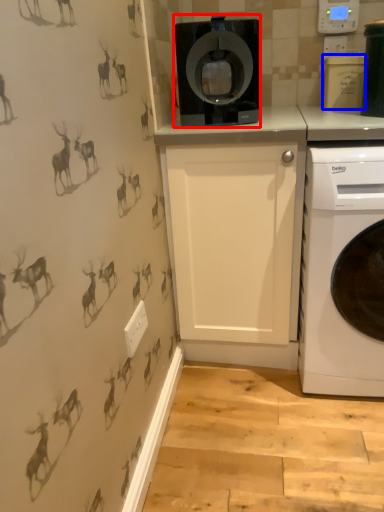
Question: Which object is closer to the camera taking this photo, home appliance (highlighted by a red box) or appliance (highlighted by a blue box)?

Choices:
 (A) home appliance
 (B) appliance

Answer: (A)